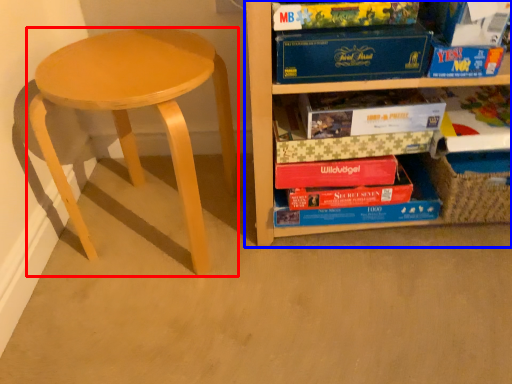
Question: Among these objects, which one is nearest to the camera, stool (highlighted by a red box) or shelf (highlighted by a blue box)?

Choices:
 (A) stool
 (B) shelf

Answer: (B)